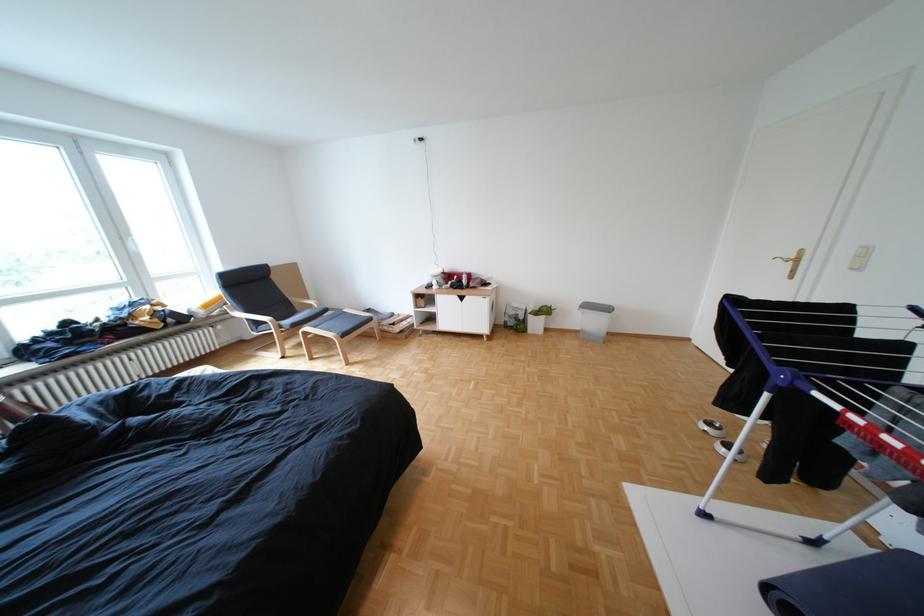
Describe the element at coordinates (342, 322) in the screenshot. I see `the footrest cushion` at that location.